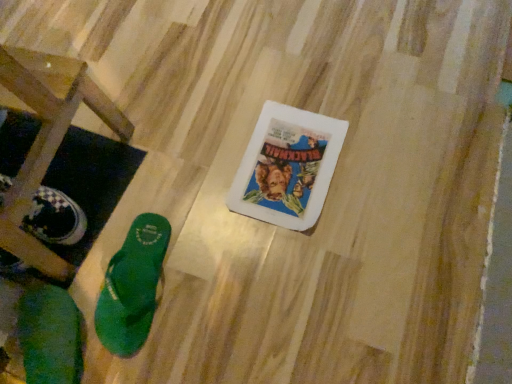
Where is `free space in front of green rubber flip-flop at lower left, acting as the 2th footwear starting from the left`? Image resolution: width=512 pixels, height=384 pixels. free space in front of green rubber flip-flop at lower left, acting as the 2th footwear starting from the left is located at coordinates 163,351.